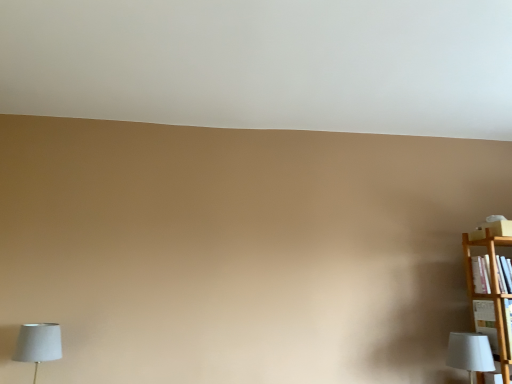
Question: Is white fabric lampshade at lower left, the first lamp when ordered from left to right, spatially inside white fabric lampshade at lower right, the second lamp positioned from the left, or outside of it?

Choices:
 (A) inside
 (B) outside

Answer: (B)

Question: Considering the positions of white fabric lampshade at lower left, the first lamp when ordered from left to right, and white fabric lampshade at lower right, the second lamp positioned from the left, in the image, is white fabric lampshade at lower left, the first lamp when ordered from left to right, bigger or smaller than white fabric lampshade at lower right, the second lamp positioned from the left,?

Choices:
 (A) big
 (B) small

Answer: (A)

Question: Which object is positioned farthest from the white fabric lampshade at lower right, the second lamp positioned from the left?

Choices:
 (A) wooden bookshelf at right
 (B) white fabric lampshade at lower left, the first lamp when ordered from left to right

Answer: (B)

Question: Which is nearer to the wooden bookshelf at right?

Choices:
 (A) white fabric lampshade at lower right, the first lamp viewed from the right
 (B) white fabric lampshade at lower left, positioned as the 2th lamp in right-to-left order

Answer: (A)